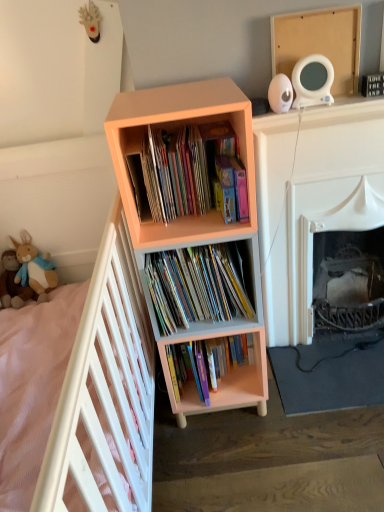
This screenshot has width=384, height=512. What do you see at coordinates (105, 393) in the screenshot?
I see `white wooden bed at left` at bounding box center [105, 393].

Describe the element at coordinates (34, 268) in the screenshot. I see `brown plush toy at lower left, the second toy viewed from the left` at that location.

You are a GUI agent. You are given a task and a screenshot of the screen. Output one action in this format:
    pyautogui.click(x=<x>, y=<y>)
    Task: Click on the hardcover books at center, the first book when ordered from bottom to top
    The width and height of the screenshot is (384, 512).
    Given the screenshot: What is the action you would take?
    pyautogui.click(x=220, y=375)

What are the coordinates of `matte cardboard books at center, which is the 2th book in bottom-to-top order` in the screenshot? It's located at (195, 287).

Find the location of a particular element. The image size is (384, 512). matte pink bookshelf at center, positioned as the first book in top-to-bottom order is located at coordinates (194, 173).

You are a GUI agent. You are given a task and a screenshot of the screen. Output one action in this format:
    pyautogui.click(x=<x>, y=<y>)
    Task: Click on the white wooden bed at left
    This screenshot has width=384, height=512.
    Given the screenshot: What is the action you would take?
    (105, 393)

Is hardcover books at center, the first book when ordered from bottom to top, oriented towards matte pink bookshelf at center, which is the third book from bottom to top?

No, hardcover books at center, the first book when ordered from bottom to top, is not aimed at matte pink bookshelf at center, which is the third book from bottom to top.

Is hardcover books at center, the 3th book viewed from the top, surrounding matte pink bookshelf at center, positioned as the first book in top-to-bottom order?

No, matte pink bookshelf at center, positioned as the first book in top-to-bottom order, is not inside hardcover books at center, the 3th book viewed from the top.

Looking at the image, does hardcover books at center, the 3th book viewed from the top, seem bigger or smaller compared to matte pink bookshelf at center, positioned as the first book in top-to-bottom order?

In the image, hardcover books at center, the 3th book viewed from the top, appears to be larger than matte pink bookshelf at center, positioned as the first book in top-to-bottom order.

Which object is closer to the camera taking this photo, hardcover books at center, the first book when ordered from bottom to top, or matte pink bookshelf at center, positioned as the first book in top-to-bottom order?

matte pink bookshelf at center, positioned as the first book in top-to-bottom order, is closer to the camera.

Is brown plush toy at lower left, the second toy viewed from the left, at the right side of matte pink bookshelf at center, which is the third book from bottom to top?

In fact, brown plush toy at lower left, the second toy viewed from the left, is to the left of matte pink bookshelf at center, which is the third book from bottom to top.

Does brown plush toy at lower left, the second toy viewed from the left, have a lesser height compared to matte pink bookshelf at center, positioned as the first book in top-to-bottom order?

Indeed, brown plush toy at lower left, the second toy viewed from the left, has a lesser height compared to matte pink bookshelf at center, positioned as the first book in top-to-bottom order.

From a real-world perspective, which is physically below, brown plush toy at lower left, which appears as the 1th toy when viewed from the right, or matte pink bookshelf at center, positioned as the first book in top-to-bottom order?

brown plush toy at lower left, which appears as the 1th toy when viewed from the right, is physically lower.

Is brown plush toy at lower left, which appears as the 1th toy when viewed from the right, inside or outside of matte pink bookshelf at center, which is the third book from bottom to top?

brown plush toy at lower left, which appears as the 1th toy when viewed from the right, is spatially situated outside matte pink bookshelf at center, which is the third book from bottom to top.

Looking at this image, does hardcover books at center, the 3th book viewed from the top, have a greater width compared to soft plush toy at left, marked as the second toy in a right-to-left arrangement?

Yes.

Which object is positioned more to the right, hardcover books at center, the first book when ordered from bottom to top, or soft plush toy at left, the first toy positioned from the left?

From the viewer's perspective, hardcover books at center, the first book when ordered from bottom to top, appears more on the right side.

Can you see hardcover books at center, the 3th book viewed from the top, touching soft plush toy at left, the first toy positioned from the left?

hardcover books at center, the 3th book viewed from the top, is not next to soft plush toy at left, the first toy positioned from the left, and they're not touching.

Can you tell me how much hardcover books at center, the first book when ordered from bottom to top, and soft plush toy at left, marked as the second toy in a right-to-left arrangement, differ in facing direction?

1.15 degrees separate the facing orientations of hardcover books at center, the first book when ordered from bottom to top, and soft plush toy at left, marked as the second toy in a right-to-left arrangement.

Consider the image. From the image's perspective, is peach matte bookcase at center located above or below matte pink bookshelf at center, which is the third book from bottom to top?

Based on their image positions, peach matte bookcase at center is located beneath matte pink bookshelf at center, which is the third book from bottom to top.

Is peach matte bookcase at center facing towards matte pink bookshelf at center, positioned as the first book in top-to-bottom order?

Yes, peach matte bookcase at center faces towards matte pink bookshelf at center, positioned as the first book in top-to-bottom order.

The height and width of the screenshot is (512, 384). Find the location of `the 2nd book directly above the peach matte bookcase at center (from a real-world perspective)`. the 2nd book directly above the peach matte bookcase at center (from a real-world perspective) is located at coordinates (194, 173).

In the image, is peach matte bookcase at center positioned in front of or behind matte pink bookshelf at center, which is the third book from bottom to top?

peach matte bookcase at center is positioned closer to the viewer than matte pink bookshelf at center, which is the third book from bottom to top.

Which is closer, (33, 284) or (232, 398)?

The point (232, 398) is closer.

Which object is positioned more to the left, brown plush toy at lower left, the second toy viewed from the left, or hardcover books at center, the first book when ordered from bottom to top?

From the viewer's perspective, brown plush toy at lower left, the second toy viewed from the left, appears more on the left side.

From a real-world perspective, is brown plush toy at lower left, which appears as the 1th toy when viewed from the right, under hardcover books at center, the 3th book viewed from the top?

No, from a real-world perspective, brown plush toy at lower left, which appears as the 1th toy when viewed from the right, is not under hardcover books at center, the 3th book viewed from the top.

At what (x,y) coordinates should I click in order to perform the action: click on the 1st toy to the left of the hardcover books at center, the 3th book viewed from the top, counting from the anchor's position. Please return your answer as a coordinate pair (x, y). This screenshot has height=512, width=384. Looking at the image, I should click on (34, 268).

Is matte cardboard books at center, which is the 2th book in bottom-to-top order, not close to hardcover books at center, the first book when ordered from bottom to top?

No, matte cardboard books at center, which is the 2th book in bottom-to-top order, is not far from hardcover books at center, the first book when ordered from bottom to top.

Between matte cardboard books at center, the second book when ordered from top to bottom, and hardcover books at center, the 3th book viewed from the top, which one has less height?

With less height is hardcover books at center, the 3th book viewed from the top.

From the image's perspective, starting from the hardcover books at center, the 3th book viewed from the top, which book is the 1st one above? Please provide its 2D coordinates.

[(195, 287)]

From the image's perspective, which is above, matte pink bookshelf at center, positioned as the first book in top-to-bottom order, or peach matte bookcase at center?

matte pink bookshelf at center, positioned as the first book in top-to-bottom order.

From the picture: Which point is more forward, (239, 201) or (139, 151)?

Point (239, 201)

Based on the photo, from a real-world perspective, is matte pink bookshelf at center, which is the third book from bottom to top, over peach matte bookcase at center?

Indeed, from a real-world perspective, matte pink bookshelf at center, which is the third book from bottom to top, stands above peach matte bookcase at center.

Image resolution: width=384 pixels, height=512 pixels. In order to click on book that is the 2nd one when counting downward from the matte pink bookshelf at center, positioned as the first book in top-to-bottom order (from the image's perspective) in this screenshot , I will do `click(220, 375)`.

Locate an element on the screen. Image resolution: width=384 pixels, height=512 pixels. the 2nd book positioned above the brown plush toy at lower left, which appears as the 1th toy when viewed from the right (from a real-world perspective) is located at coordinates (194, 173).

Based on the photo, which object lies nearer to the anchor point peach matte bookcase at center, hardcover books at center, the first book when ordered from bottom to top, or soft plush toy at left, the first toy positioned from the left?

hardcover books at center, the first book when ordered from bottom to top, lies closer to peach matte bookcase at center than the other object.

Looking at the image, which one is located further to hardcover books at center, the first book when ordered from bottom to top, brown plush toy at lower left, which appears as the 1th toy when viewed from the right, or matte cardboard books at center, which is the 2th book in bottom-to-top order?

brown plush toy at lower left, which appears as the 1th toy when viewed from the right.

When comparing their distances from matte cardboard books at center, which is the 2th book in bottom-to-top order, does hardcover books at center, the 3th book viewed from the top, or brown plush toy at lower left, which appears as the 1th toy when viewed from the right, seem closer?

hardcover books at center, the 3th book viewed from the top, is closer to matte cardboard books at center, which is the 2th book in bottom-to-top order.

When comparing their distances from white wooden bed at left, does soft plush toy at left, marked as the second toy in a right-to-left arrangement, or brown plush toy at lower left, the second toy viewed from the left, seem further?

Based on the image, soft plush toy at left, marked as the second toy in a right-to-left arrangement, appears to be further to white wooden bed at left.

Which object lies nearer to the anchor point brown plush toy at lower left, which appears as the 1th toy when viewed from the right, soft plush toy at left, the first toy positioned from the left, or matte cardboard books at center, the second book when ordered from top to bottom?

Based on the image, soft plush toy at left, the first toy positioned from the left, appears to be nearer to brown plush toy at lower left, which appears as the 1th toy when viewed from the right.

From the image, which object appears to be farther from matte pink bookshelf at center, which is the third book from bottom to top, hardcover books at center, the 3th book viewed from the top, or peach matte bookcase at center?

hardcover books at center, the 3th book viewed from the top, is positioned further to the anchor matte pink bookshelf at center, which is the third book from bottom to top.

From the image, which object appears to be nearer to soft plush toy at left, the first toy positioned from the left, matte pink bookshelf at center, positioned as the first book in top-to-bottom order, or hardcover books at center, the first book when ordered from bottom to top?

hardcover books at center, the first book when ordered from bottom to top, lies closer to soft plush toy at left, the first toy positioned from the left, than the other object.

Consider the image. Based on their spatial positions, is white wooden bed at left or hardcover books at center, the 3th book viewed from the top, closer to soft plush toy at left, marked as the second toy in a right-to-left arrangement?

hardcover books at center, the 3th book viewed from the top, lies closer to soft plush toy at left, marked as the second toy in a right-to-left arrangement, than the other object.

Locate an element on the screen. book between white wooden bed at left and matte cardboard books at center, which is the 2th book in bottom-to-top order, from front to back is located at coordinates (194, 173).

Where is `bookcase between matte pink bookshelf at center, which is the third book from bottom to top, and hardcover books at center, the first book when ordered from bottom to top, vertically`? This screenshot has width=384, height=512. bookcase between matte pink bookshelf at center, which is the third book from bottom to top, and hardcover books at center, the first book when ordered from bottom to top, vertically is located at coordinates (193, 216).

Find the location of a particular element. bookcase between brown plush toy at lower left, the second toy viewed from the left, and hardcover books at center, the first book when ordered from bottom to top is located at coordinates (193, 216).

Identify the location of toy between soft plush toy at left, marked as the second toy in a right-to-left arrangement, and hardcover books at center, the first book when ordered from bottom to top, in the horizontal direction. This screenshot has height=512, width=384. (34, 268).